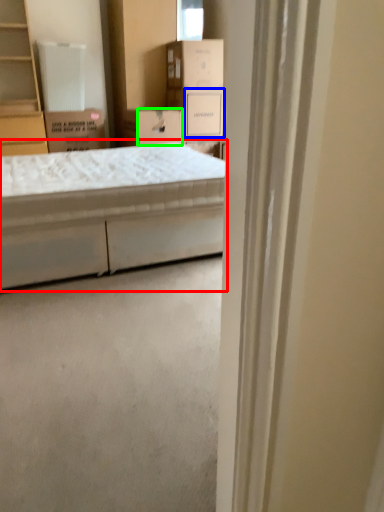
Question: Estimate the real-world distances between objects in this image. Which object is closer to bed (highlighted by a red box), storage box (highlighted by a blue box) or storage box (highlighted by a green box)?

Choices:
 (A) storage box
 (B) storage box

Answer: (B)